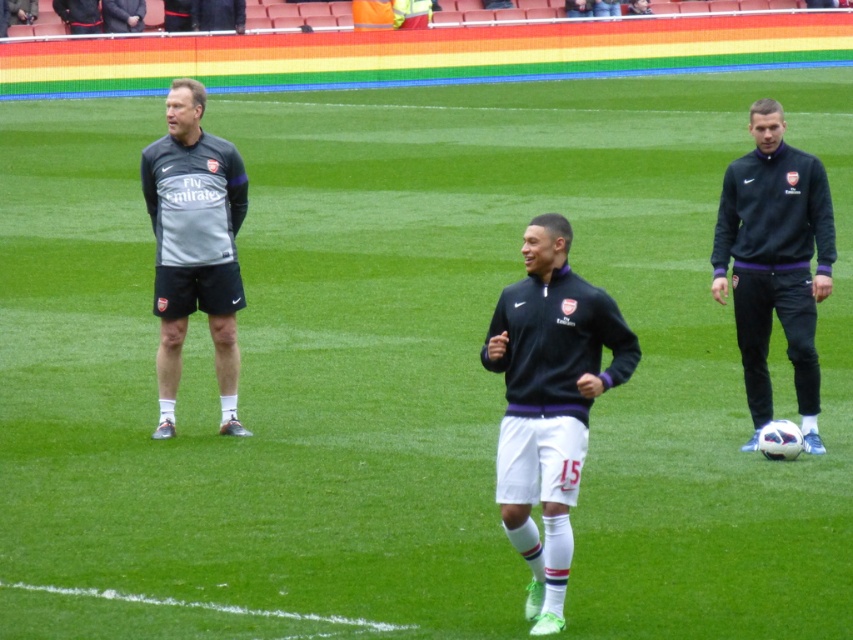
Between dark blue jersey at right and gray matte jacket at left, which one appears on the left side from the viewer's perspective?

gray matte jacket at left

Where is `dark blue jersey at right`? The height and width of the screenshot is (640, 853). dark blue jersey at right is located at coordinates [775, 262].

Between black matte jacket at center and dark blue jersey at right, which one appears on the left side from the viewer's perspective?

black matte jacket at center

Identify the location of black matte jacket at center. (549, 401).

Identify the location of black matte jacket at center. (549, 401).

Can you confirm if black matte jacket at center is positioned to the left of gray matte jacket at left?

Incorrect, black matte jacket at center is not on the left side of gray matte jacket at left.

Is point (527, 237) in front of point (212, 317)?

Yes, it is.

The width and height of the screenshot is (853, 640). Identify the location of black matte jacket at center. (549, 401).